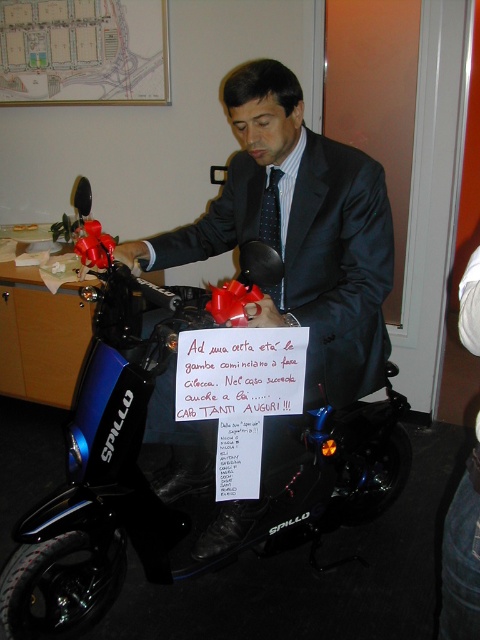
You are a fashion designer observing a man dressed in a dark suit and tie standing next to a motorbike. You need to determine the spatial relationship between the shiny black suit at center and the black dotted tie at center. Based on the scene, which object is located below the other?

The shiny black suit at center is positioned under the black dotted tie at center, meaning the suit is below the tie.

You are a delivery person who needs to attach a package to the blue glossy scooter at center. Where should you place the package so it doesn not block the white paper sign at center?

The blue glossy scooter at center is located below the white paper sign at center, so placing the package on the scooter or lower areas would keep it from blocking the sign.

You are a fashion designer observing a man dressed in a dark suit and tie standing next to a black motorbike. You need to determine which item is taller between the shiny black suit at center and the black dotted tie at center. Which one is taller?

The shiny black suit at center is taller than the black dotted tie at center according to the description.